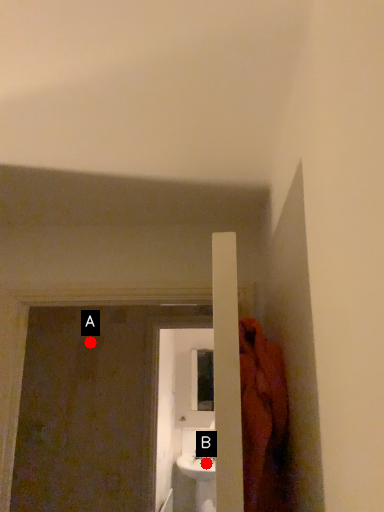
Question: Two points are circled on the image, labeled by A and B beside each circle. Which point is closer to the camera?

Choices:
 (A) A is closer
 (B) B is closer

Answer: (A)